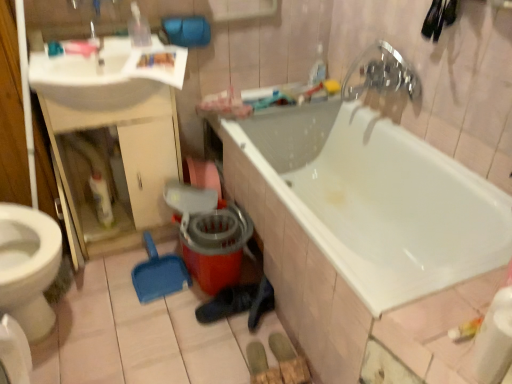
Question: Is chrome metallic faucet at upper right facing away from white glossy sink at upper left?

Choices:
 (A) yes
 (B) no

Answer: (B)

Question: Considering the relative positions of chrome metallic faucet at upper right and white glossy sink at upper left in the image provided, is chrome metallic faucet at upper right to the right of white glossy sink at upper left from the viewer's perspective?

Choices:
 (A) yes
 (B) no

Answer: (A)

Question: Is chrome metallic faucet at upper right located outside white glossy sink at upper left?

Choices:
 (A) no
 (B) yes

Answer: (B)

Question: Can you confirm if chrome metallic faucet at upper right is thinner than white glossy sink at upper left?

Choices:
 (A) no
 (B) yes

Answer: (B)

Question: From the image's perspective, is chrome metallic faucet at upper right above white glossy sink at upper left?

Choices:
 (A) no
 (B) yes

Answer: (B)

Question: Is chrome metallic faucet at upper right spatially inside white glossy bottle at left, or outside of it?

Choices:
 (A) inside
 (B) outside

Answer: (B)

Question: Considering their positions, is chrome metallic faucet at upper right located in front of or behind white glossy bottle at left?

Choices:
 (A) front
 (B) behind

Answer: (A)

Question: Considering the positions of chrome metallic faucet at upper right and white glossy bottle at left in the image, is chrome metallic faucet at upper right wider or thinner than white glossy bottle at left?

Choices:
 (A) thin
 (B) wide

Answer: (B)

Question: From a real-world perspective, is chrome metallic faucet at upper right physically located above or below white glossy bottle at left?

Choices:
 (A) above
 (B) below

Answer: (A)

Question: Is point (109, 61) closer or farther from the camera than point (377, 173)?

Choices:
 (A) closer
 (B) farther

Answer: (A)

Question: From a real-world perspective, relative to white glossy bathtub at center, is white glossy sink at upper left vertically above or below?

Choices:
 (A) below
 (B) above

Answer: (B)

Question: In terms of width, does white glossy sink at upper left look wider or thinner when compared to white glossy bathtub at center?

Choices:
 (A) wide
 (B) thin

Answer: (B)

Question: Is white glossy sink at upper left inside or outside of white glossy bathtub at center?

Choices:
 (A) outside
 (B) inside

Answer: (A)

Question: Considering the positions of white glossy bathtub at center and chrome metallic faucet at upper right in the image, is white glossy bathtub at center taller or shorter than chrome metallic faucet at upper right?

Choices:
 (A) tall
 (B) short

Answer: (A)

Question: From a real-world perspective, is white glossy bathtub at center above or below chrome metallic faucet at upper right?

Choices:
 (A) above
 (B) below

Answer: (B)